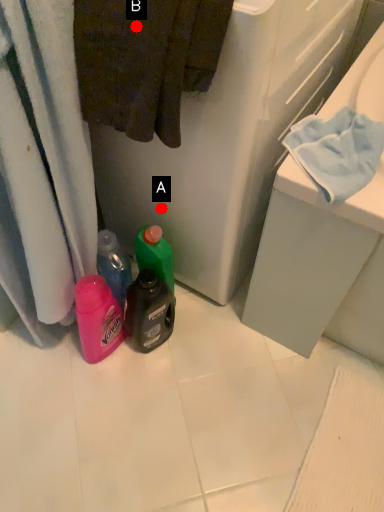
Question: Two points are circled on the image, labeled by A and B beside each circle. Which point is further to the camera?

Choices:
 (A) A is further
 (B) B is further

Answer: (A)